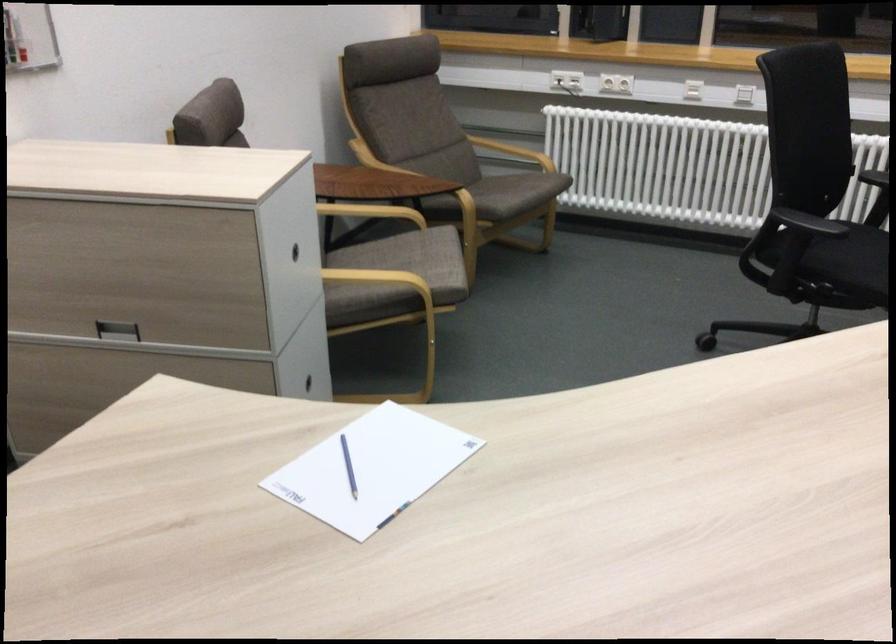
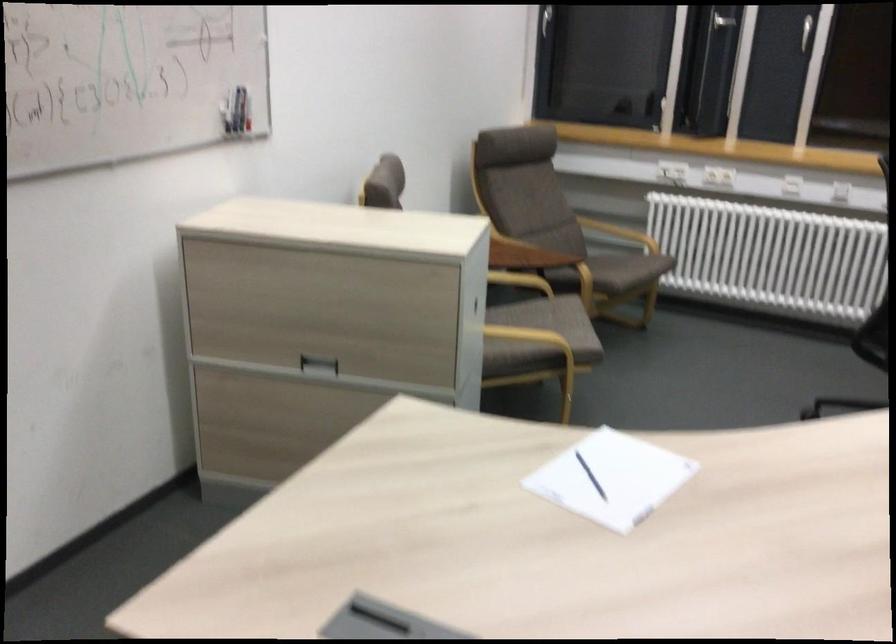
What movement of the cameraman would produce the second image?

The movement direction of the cameraman is left, backward.